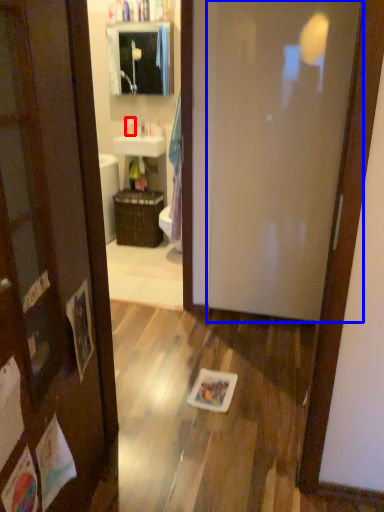
Question: Which of the following is the closest to the observer, toiletry (highlighted by a red box) or door (highlighted by a blue box)?

Choices:
 (A) toiletry
 (B) door

Answer: (B)